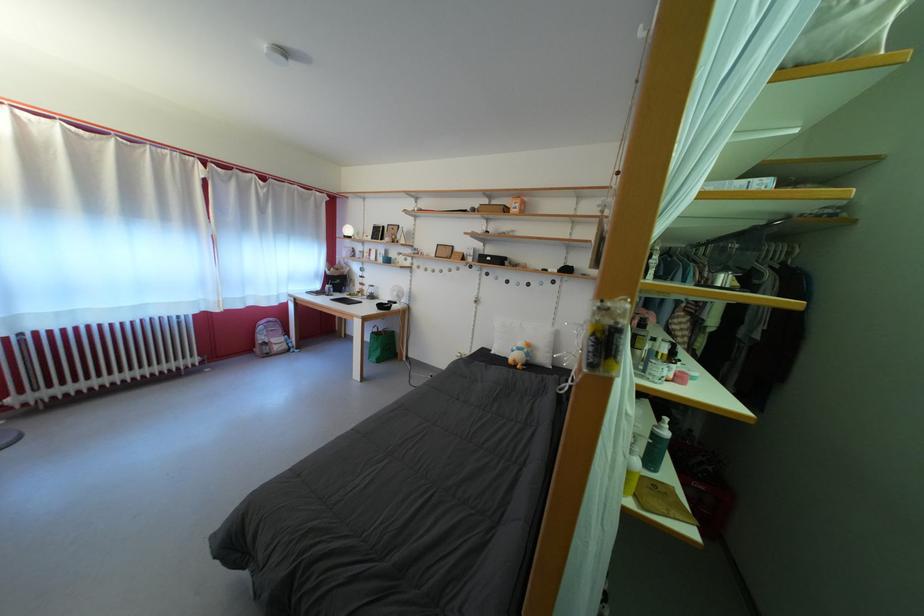
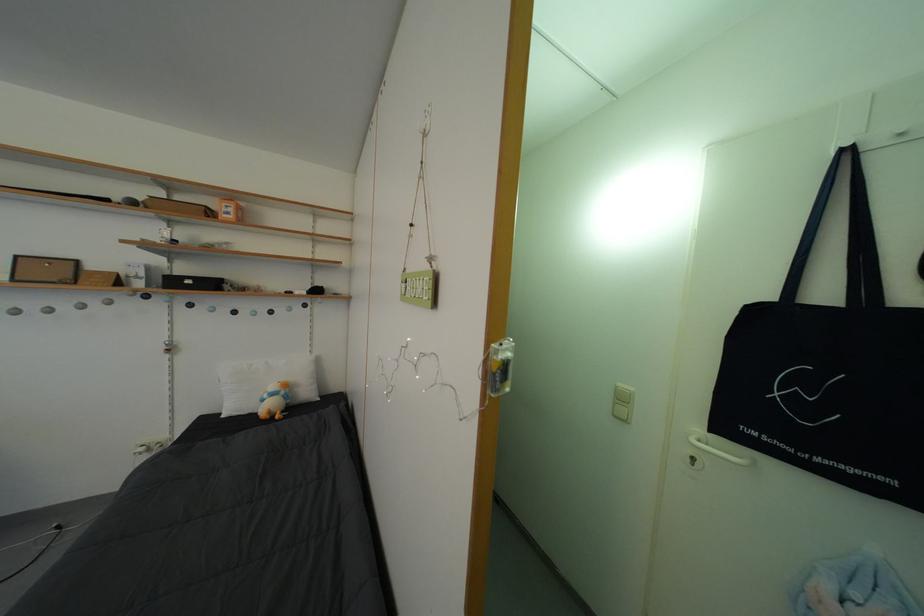
Question: The images are taken continuously from a first-person perspective. In which direction is your viewpoint rotating?

Choices:
 (A) Left
 (B) Right
 (C) Up
 (D) Down

Answer: (B)